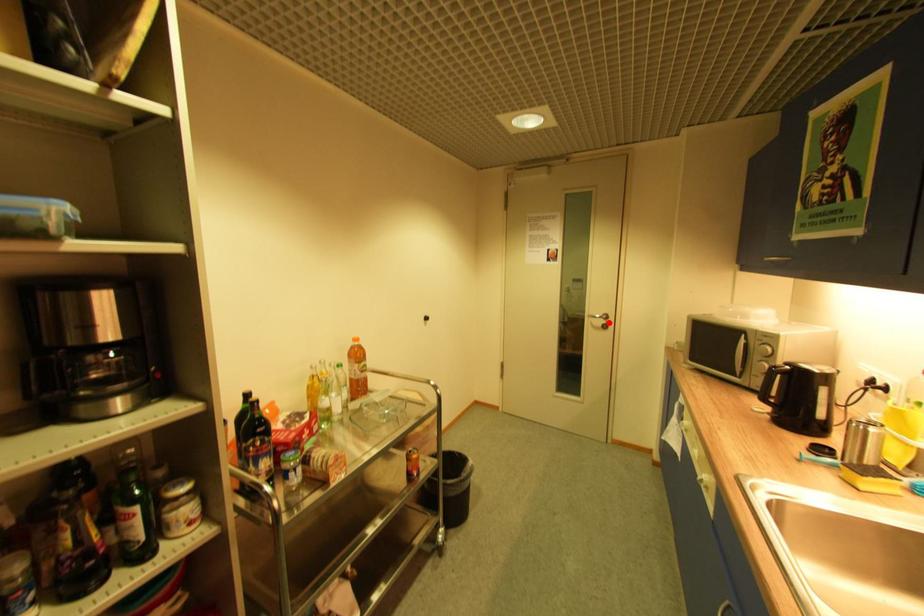
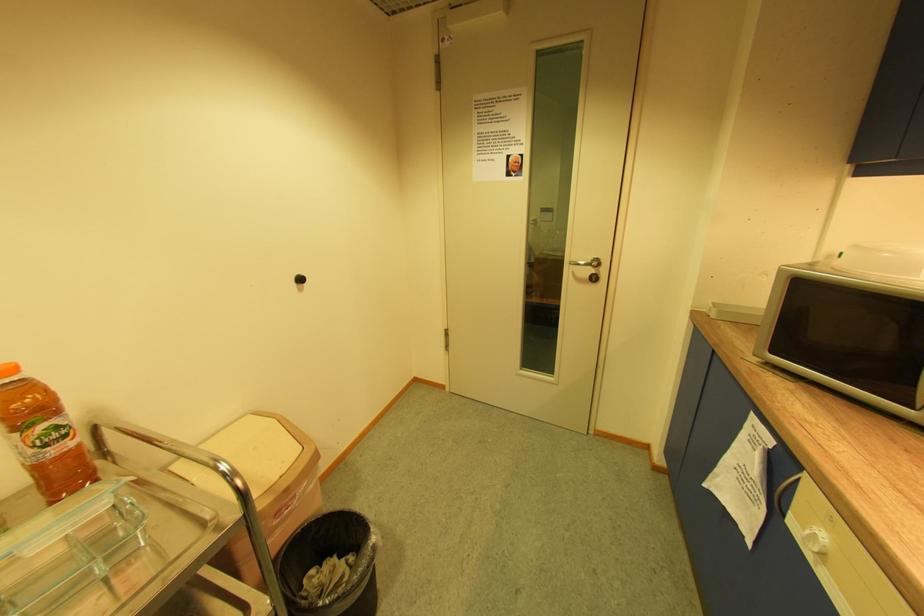
Question: I am providing you with two images of the same scene from different viewpoints. Image1 has a red point marked. In image2, the corresponding 3D location appears at what relative position? Reply with the corresponding letter.

Choices:
 (A) Closer
 (B) Farther

Answer: (B)